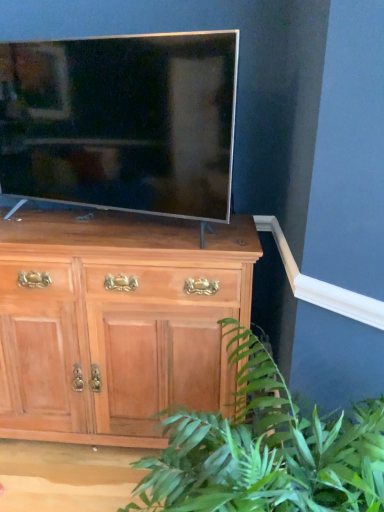
The image size is (384, 512). What do you see at coordinates (121, 121) in the screenshot? I see `satin silver tv at center` at bounding box center [121, 121].

What is the approximate width of green leafy plant at lower right?

30.19 inches.

The height and width of the screenshot is (512, 384). I want to click on satin silver tv at center, so click(121, 121).

Does point (147, 319) appear closer or farther from the camera than point (117, 123)?

Point (147, 319).

Considering the sizes of objects light brown wood chest of drawers at center and satin silver tv at center in the image provided, who is taller, light brown wood chest of drawers at center or satin silver tv at center?

With more height is light brown wood chest of drawers at center.

Is light brown wood chest of drawers at center inside or outside of satin silver tv at center?

light brown wood chest of drawers at center is outside satin silver tv at center.

Can you tell me how much light brown wood chest of drawers at center and green leafy plant at lower right differ in facing direction?

The angle between the facing direction of light brown wood chest of drawers at center and the facing direction of green leafy plant at lower right is 46.2 degrees.

Does light brown wood chest of drawers at center have a lesser height compared to green leafy plant at lower right?

Incorrect, the height of light brown wood chest of drawers at center does not fall short of that of green leafy plant at lower right.

Locate an element on the screen. The width and height of the screenshot is (384, 512). chest of drawers on the left side of green leafy plant at lower right is located at coordinates (115, 322).

Is light brown wood chest of drawers at center in front of green leafy plant at lower right?

No, light brown wood chest of drawers at center is further to the viewer.

Is green leafy plant at lower right positioned beyond the bounds of satin silver tv at center?

green leafy plant at lower right lies outside satin silver tv at center's area.

Considering the positions of objects green leafy plant at lower right and satin silver tv at center in the image provided, who is more to the right, green leafy plant at lower right or satin silver tv at center?

green leafy plant at lower right.

Considering the sizes of green leafy plant at lower right and satin silver tv at center in the image, is green leafy plant at lower right taller or shorter than satin silver tv at center?

In the image, green leafy plant at lower right appears to be taller than satin silver tv at center.

Which point is more forward, (217, 464) or (131, 201)?

Positioned in front is point (217, 464).

From the image's perspective, is satin silver tv at center located beneath green leafy plant at lower right?

No, from the image's perspective, satin silver tv at center is not below green leafy plant at lower right.

Do you think satin silver tv at center is within green leafy plant at lower right, or outside of it?

satin silver tv at center is spatially situated outside green leafy plant at lower right.

At what (x,y) coordinates should I click in order to perform the action: click on television above the green leafy plant at lower right (from a real-world perspective). Please return your answer as a coordinate pair (x, y). Looking at the image, I should click on (121, 121).

Is green leafy plant at lower right placed right next to light brown wood chest of drawers at center?

green leafy plant at lower right and light brown wood chest of drawers at center are clearly separated.

From the image's perspective, between green leafy plant at lower right and light brown wood chest of drawers at center, who is located below?

green leafy plant at lower right, from the image's perspective.

In terms of size, does green leafy plant at lower right appear bigger or smaller than light brown wood chest of drawers at center?

In the image, green leafy plant at lower right appears to be smaller than light brown wood chest of drawers at center.

Is the depth of green leafy plant at lower right less than that of light brown wood chest of drawers at center?

Yes, the depth of green leafy plant at lower right is less than that of light brown wood chest of drawers at center.

Choose the correct answer: Is satin silver tv at center inside light brown wood chest of drawers at center or outside it?

satin silver tv at center is spatially situated outside light brown wood chest of drawers at center.

At what (x,y) coordinates should I click in order to perform the action: click on television on the right of light brown wood chest of drawers at center. Please return your answer as a coordinate pair (x, y). This screenshot has height=512, width=384. Looking at the image, I should click on (121, 121).

Is satin silver tv at center turned away from light brown wood chest of drawers at center?

No, light brown wood chest of drawers at center is not at the back of satin silver tv at center.

Between satin silver tv at center and light brown wood chest of drawers at center, which one is positioned behind?

light brown wood chest of drawers at center.

Where is `chest of drawers on the left side of satin silver tv at center`? Image resolution: width=384 pixels, height=512 pixels. chest of drawers on the left side of satin silver tv at center is located at coordinates (115, 322).

What are the coordinates of `houseplant in front of the light brown wood chest of drawers at center` in the screenshot? It's located at (266, 450).

When comparing their distances from light brown wood chest of drawers at center, does satin silver tv at center or green leafy plant at lower right seem closer?

The object closer to light brown wood chest of drawers at center is satin silver tv at center.

Estimate the real-world distances between objects in this image. Which object is further from green leafy plant at lower right, satin silver tv at center or light brown wood chest of drawers at center?

Among the two, satin silver tv at center is located further to green leafy plant at lower right.

In the scene shown: From the image, which object appears to be farther from green leafy plant at lower right, light brown wood chest of drawers at center or satin silver tv at center?

satin silver tv at center is further to green leafy plant at lower right.

From the image, which object appears to be nearer to satin silver tv at center, light brown wood chest of drawers at center or green leafy plant at lower right?

Among the two, light brown wood chest of drawers at center is located nearer to satin silver tv at center.

Looking at the image, which one is located closer to satin silver tv at center, green leafy plant at lower right or light brown wood chest of drawers at center?

light brown wood chest of drawers at center is closer to satin silver tv at center.

Estimate the real-world distances between objects in this image. Which object is closer to light brown wood chest of drawers at center, green leafy plant at lower right or satin silver tv at center?

satin silver tv at center lies closer to light brown wood chest of drawers at center than the other object.

This screenshot has height=512, width=384. In order to click on the chest of drawers between satin silver tv at center and green leafy plant at lower right vertically in this screenshot , I will do `click(115, 322)`.